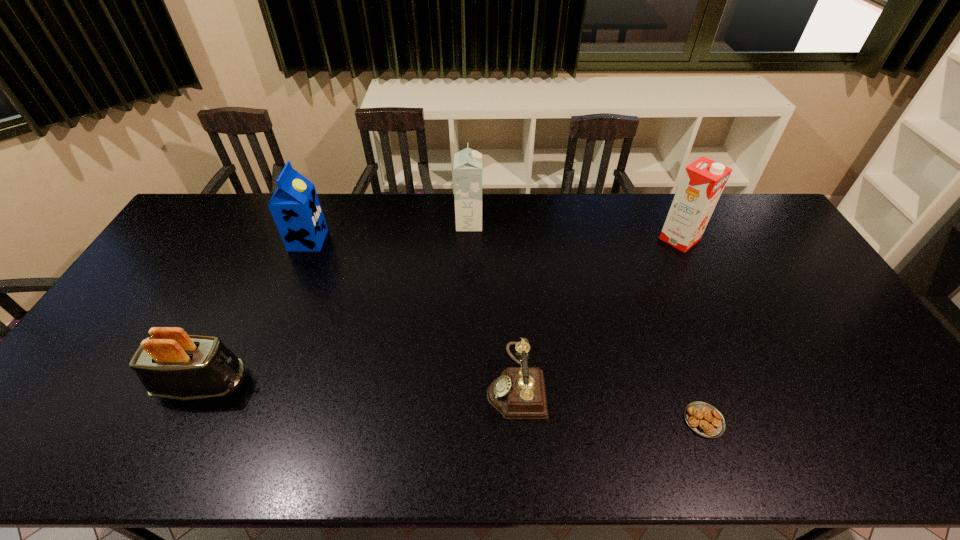
In order to click on vacant region located 0.200m with the cap open on the leftmost carton in this screenshot , I will do [383, 240].

Where is `vacant space positioned 0.100m on the side of the toaster with the control lever`? vacant space positioned 0.100m on the side of the toaster with the control lever is located at coordinates (288, 384).

Locate an element on the screen. The width and height of the screenshot is (960, 540). free location located 0.060m on the dial of the telephone is located at coordinates (463, 381).

What are the coordinates of `vacant space located on the dial of the telephone` in the screenshot? It's located at (389, 381).

I want to click on free space located 0.190m on the dial of the telephone, so click(412, 381).

Where is `vacant area situated on the back of the second object from right to left`? Image resolution: width=960 pixels, height=540 pixels. vacant area situated on the back of the second object from right to left is located at coordinates (668, 326).

Where is `object present at the near edge`? object present at the near edge is located at coordinates (704, 419).

Find the location of a particular element. This screenshot has width=960, height=540. free location at the far edge of the desktop is located at coordinates (266, 207).

Locate an element on the screen. The image size is (960, 540). vacant area at the near edge of the desktop is located at coordinates [x=627, y=455].

This screenshot has width=960, height=540. Identify the location of vacant area at the left edge of the desktop. (140, 340).